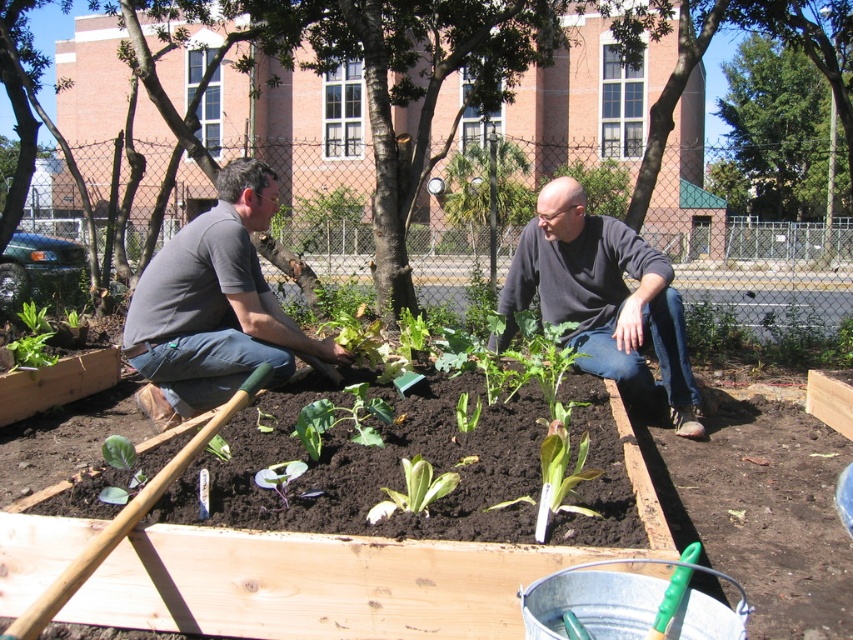
You are a delivery robot with a 1.5 meter long package that needs to be placed between the gray cotton shirt at center and the dark gray sweater at center. Can the package fit in the space between them?

The distance between the gray cotton shirt at center and the dark gray sweater at center is 1.62 meters, so the 1.5 meter long package can fit in the space between them.

You are a visitor in the community garden and see the gray cotton shirt at center and the green leafy plant at center. Which object is located to the left of the other?

The gray cotton shirt at center is positioned on the left side of green leafy plant at center.